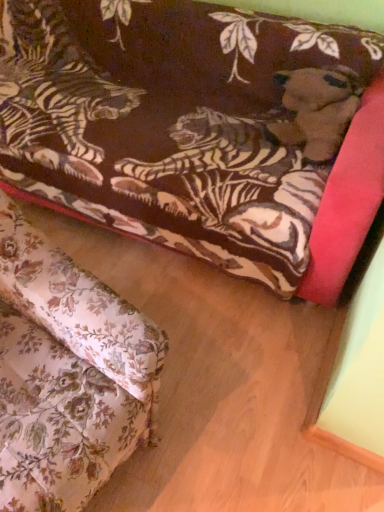
I want to click on vacant space to the right of velvet tiger-patterned couch at upper center, which ranks as the first studio couch in front-to-back order, so click(x=230, y=401).